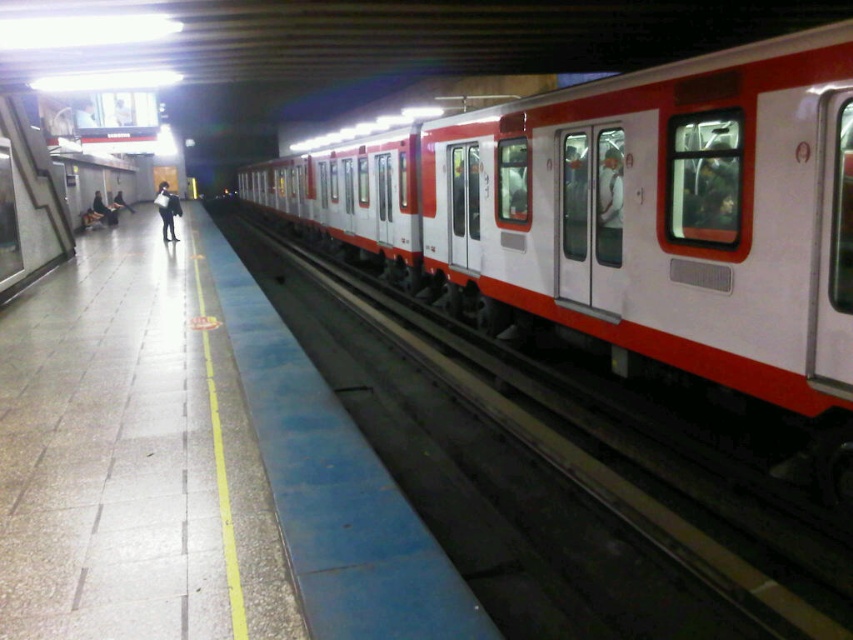
Question: Which object is farther from the camera taking this photo?

Choices:
 (A) dark blue jeans at left
 (B) white glossy train at center

Answer: (A)

Question: In this image, where is white glossy train at center located relative to white rubber track at right?

Choices:
 (A) right
 (B) left

Answer: (A)

Question: Where is white glossy train at center located in relation to dark blue jeans at left in the image?

Choices:
 (A) right
 (B) left

Answer: (A)

Question: Which point is closer to the camera?

Choices:
 (A) dark blue jeans at left
 (B) white glossy train at center

Answer: (B)

Question: Among these points, which one is farthest from the camera?

Choices:
 (A) (350, 380)
 (B) (93, 211)
 (C) (161, 209)
 (D) (543, 176)

Answer: (B)

Question: Can you confirm if black leather jacket at center is positioned to the left of dark blue jeans at left?

Choices:
 (A) no
 (B) yes

Answer: (B)